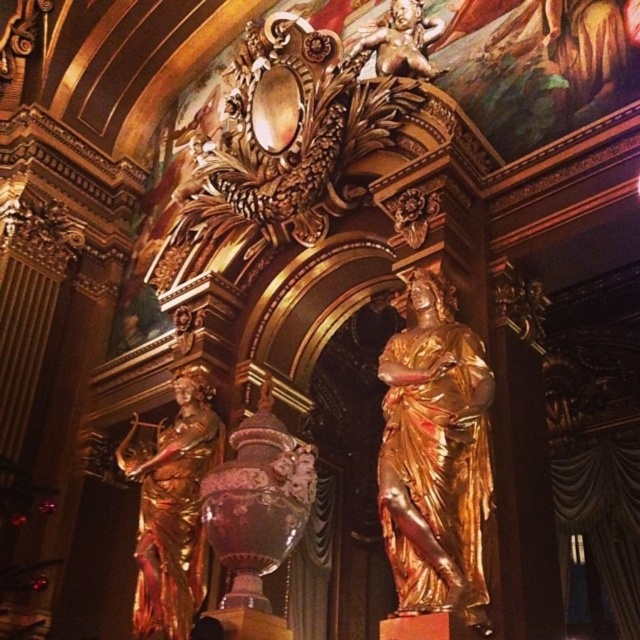
This screenshot has width=640, height=640. I want to click on gold polished statue at center, so click(x=435, y=458).

Locate an element on the screen. The height and width of the screenshot is (640, 640). gold polished statue at center is located at coordinates (435, 458).

Is gold polished statue at center behind gold polished statue at left?

No, it is not.

Can you confirm if gold polished statue at center is positioned above gold polished statue at left?

Yes, gold polished statue at center is above gold polished statue at left.

Which is in front, point (422, 528) or point (168, 516)?

Point (422, 528) is in front.

The height and width of the screenshot is (640, 640). Identify the location of gold polished statue at center. (435, 458).

Does gold polished statue at left appear on the right side of gold metallic cherub at upper center?

In fact, gold polished statue at left is to the left of gold metallic cherub at upper center.

Describe the element at coordinates (172, 508) in the screenshot. I see `gold polished statue at left` at that location.

Is point (198, 529) positioned after point (396, 26)?

No.

Identify the location of gold polished statue at left. This screenshot has width=640, height=640. (172, 508).